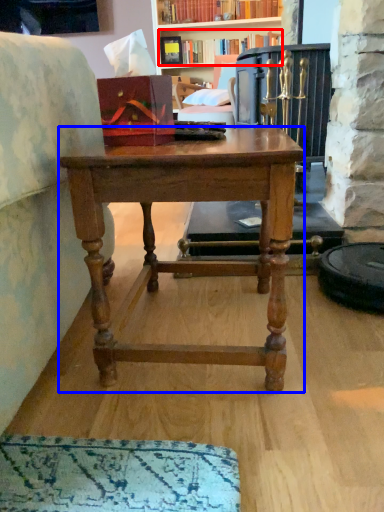
Question: Which point is closer to the camera, book (highlighted by a red box) or desk (highlighted by a blue box)?

Choices:
 (A) book
 (B) desk

Answer: (B)